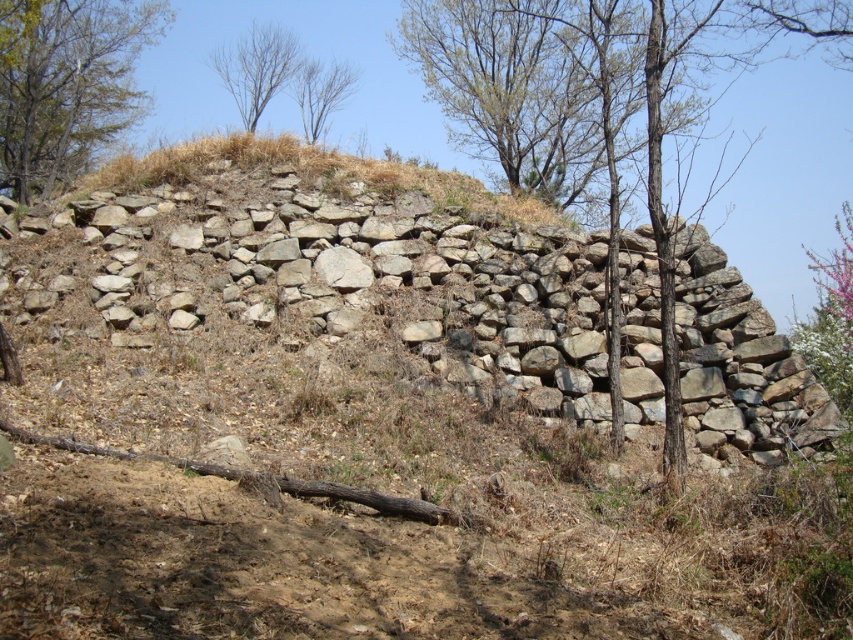
Where is `bare wood tree at center`? bare wood tree at center is located at coordinates (599, 116).

Is bare wood tree at center thinner than bare branches at upper center?

Incorrect, bare wood tree at center's width is not less than bare branches at upper center's.

Is point (737, 56) behind point (262, 56)?

Yes, point (737, 56) is behind point (262, 56).

Find the location of a particular element. bare wood tree at center is located at coordinates (599, 116).

Is bare branches at upper center taller than bare branches at center?

Correct, bare branches at upper center is much taller as bare branches at center.

What do you see at coordinates (257, 68) in the screenshot?
I see `bare branches at upper center` at bounding box center [257, 68].

At what (x,y) coordinates should I click in order to perform the action: click on bare branches at upper center. Please return your answer as a coordinate pair (x, y). Looking at the image, I should click on (257, 68).

Which is more to the right, natural stone wall at center or bare branches at upper center?

Positioned to the right is natural stone wall at center.

Does natural stone wall at center lie behind bare branches at upper center?

No.

In the scene shown: Measure the distance between natural stone wall at center and camera.

natural stone wall at center is 8.61 meters from camera.

The image size is (853, 640). I want to click on natural stone wall at center, so click(352, 273).